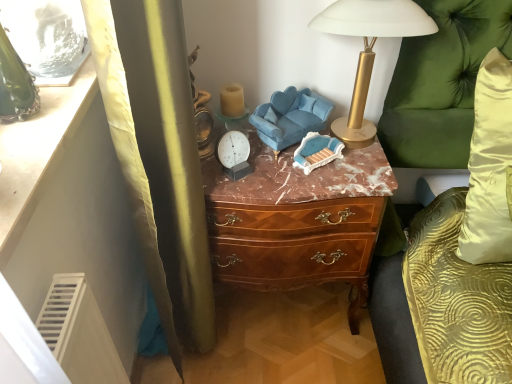
Question: Is velvet blue swivel chair at center taller or shorter than green velvet couch at right?

Choices:
 (A) short
 (B) tall

Answer: (A)

Question: From the image's perspective, is velvet blue swivel chair at center above or below green velvet couch at right?

Choices:
 (A) below
 (B) above

Answer: (B)

Question: Which of these objects is positioned closest to the velvet blue swivel chair at center?

Choices:
 (A) matte white vanity at upper left
 (B) gold metallic lamp at upper right
 (C) green velvet couch at right
 (D) brown wood chest of drawers at center

Answer: (B)

Question: Which object is the farthest from the velvet blue swivel chair at center?

Choices:
 (A) matte white vanity at upper left
 (B) gold metallic lamp at upper right
 (C) green velvet couch at right
 (D) brown wood chest of drawers at center

Answer: (A)